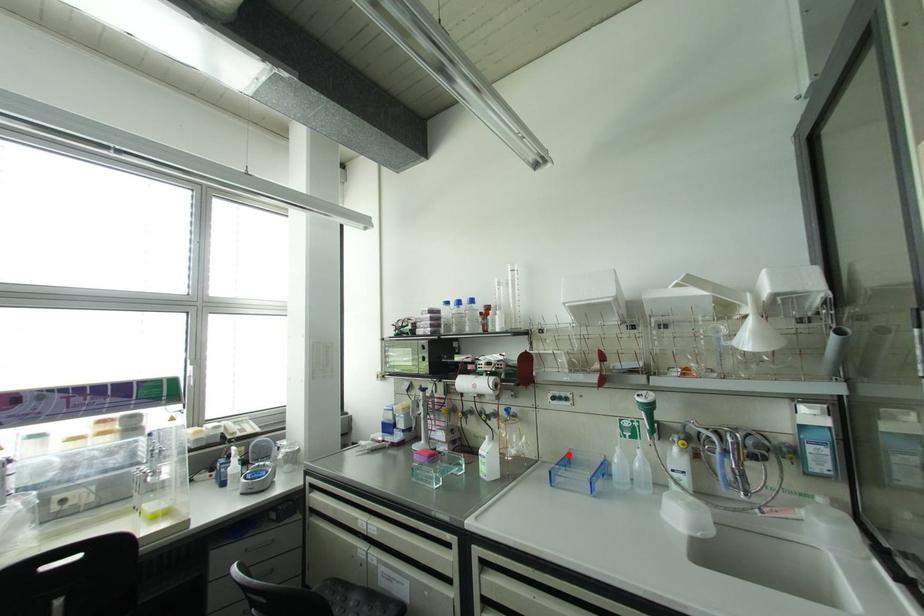
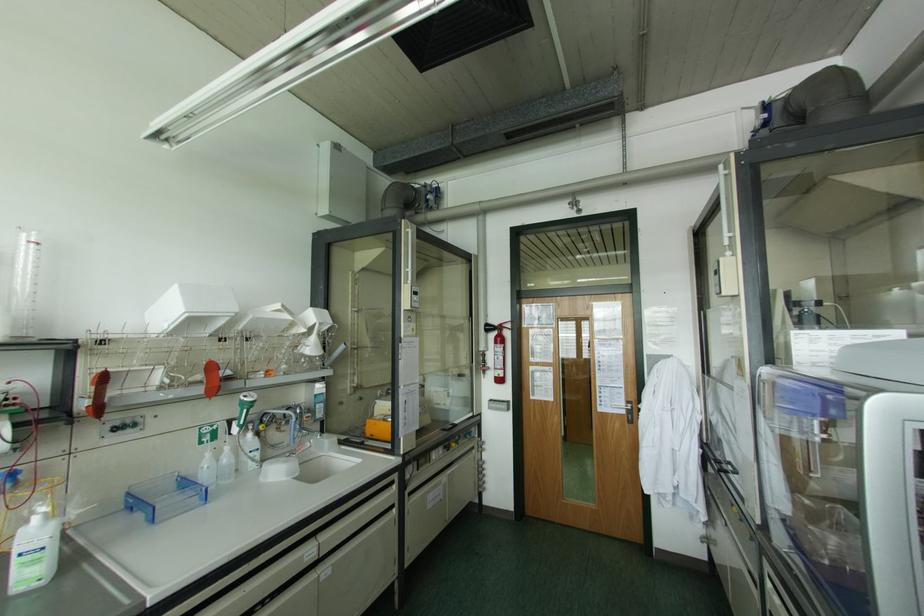
In the second image, find the point that corresponds to the highlighted location in the first image.

(128, 493)